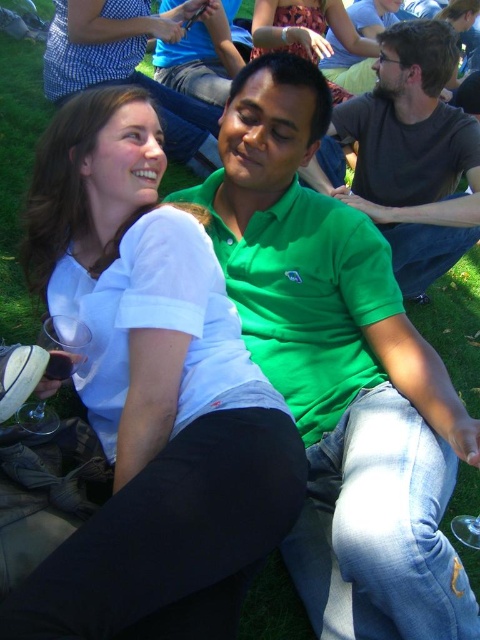
From the picture: Can you confirm if green cotton shirt at center is wider than transparent plastic wine glass at lower left?

Yes, green cotton shirt at center is wider than transparent plastic wine glass at lower left.

Image resolution: width=480 pixels, height=640 pixels. Describe the element at coordinates (414, 154) in the screenshot. I see `green cotton shirt at center` at that location.

Who is more distant from viewer, [374,96] or [35,412]?

Point [374,96]

Identify the location of green cotton shirt at center. (414, 154).

Who is taller, transparent plastic wine glass at lower left or clear plastic cup at lower left?

transparent plastic wine glass at lower left

Who is more forward, (69, 346) or (58, 362)?

Positioned in front is point (58, 362).

This screenshot has height=640, width=480. Identify the location of transparent plastic wine glass at lower left. (63, 344).

This screenshot has width=480, height=640. What do you see at coordinates (202, 56) in the screenshot? I see `green matte shirt at center` at bounding box center [202, 56].

Which is behind, point (163, 44) or point (319, 19)?

Positioned behind is point (163, 44).

Is point (225, 84) positioned before point (313, 44)?

No, (225, 84) is further to viewer.

The height and width of the screenshot is (640, 480). I want to click on green matte shirt at center, so click(x=202, y=56).